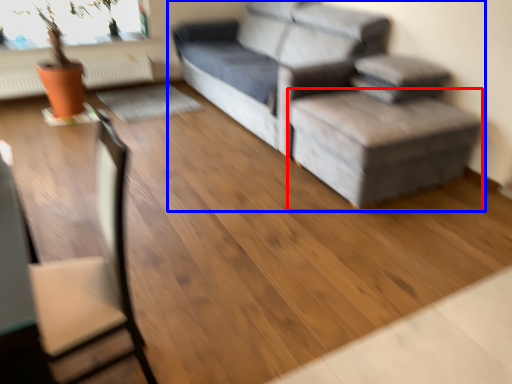
Question: Which object is closer to the camera taking this photo, stool (highlighted by a red box) or studio couch (highlighted by a blue box)?

Choices:
 (A) stool
 (B) studio couch

Answer: (A)